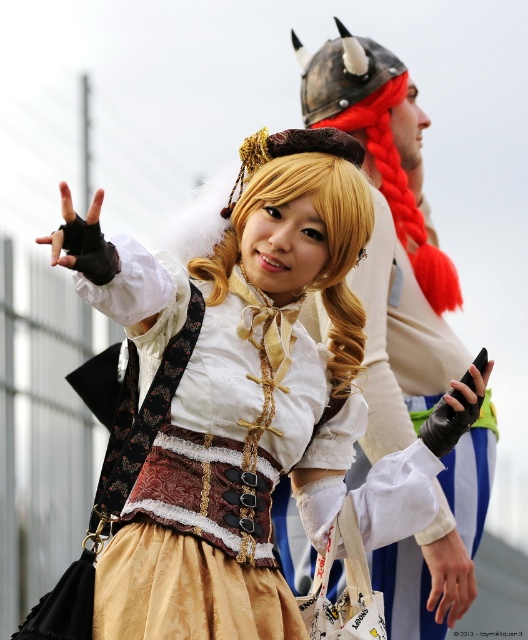
Question: Does matte gold skirt at center have a lesser width compared to white fabric helmet at upper center?

Choices:
 (A) no
 (B) yes

Answer: (A)

Question: Which object appears closest to the camera in this image?

Choices:
 (A) matte gold skirt at center
 (B) metallic silver helmet at upper center

Answer: (A)

Question: Among these points, which one is farthest from the camera?

Choices:
 (A) (365, 96)
 (B) (285, 464)

Answer: (A)

Question: Where is matte gold skirt at center located in relation to white fabric helmet at upper center in the image?

Choices:
 (A) above
 (B) below

Answer: (B)

Question: Which object is positioned closest to the matte gold skirt at center?

Choices:
 (A) white fabric helmet at upper center
 (B) metallic silver helmet at upper center

Answer: (A)

Question: Does matte gold skirt at center appear on the left side of white fabric helmet at upper center?

Choices:
 (A) yes
 (B) no

Answer: (A)